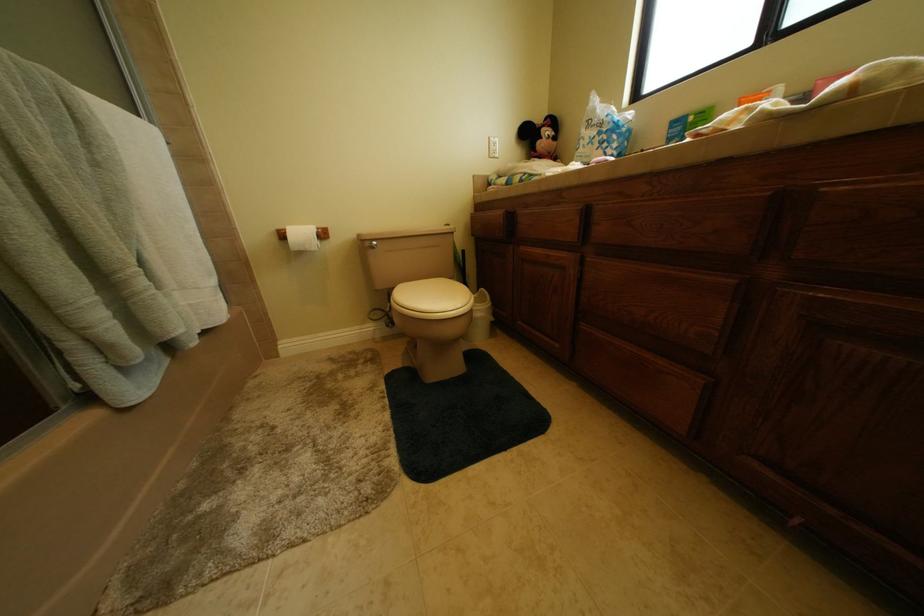
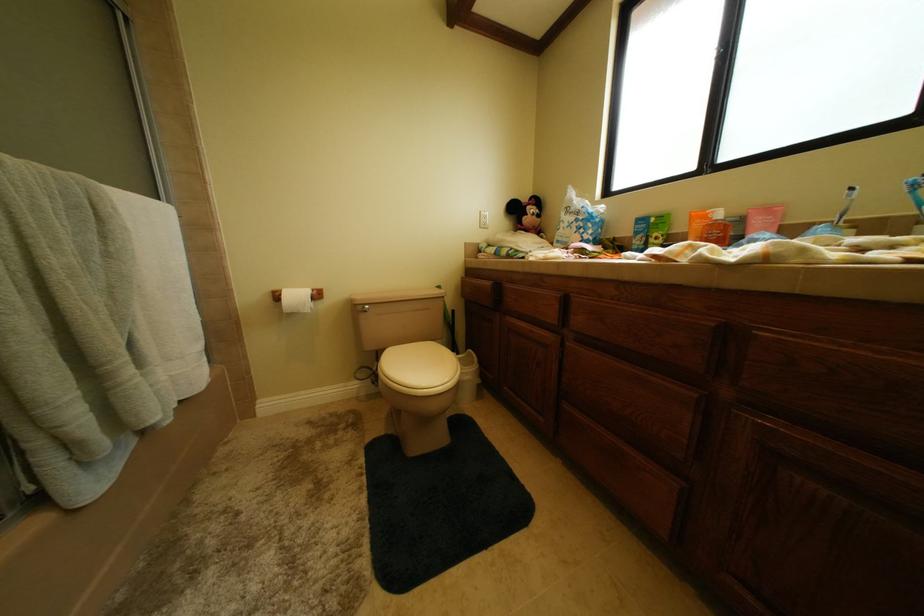
Question: The first image is from the beginning of the video and the second image is from the end. How did the camera likely rotate when shooting the video?

Choices:
 (A) Left
 (B) Right
 (C) Up
 (D) Down

Answer: (C)